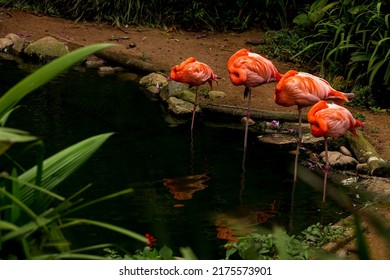
Find the location of a particular element. The image size is (390, 280). picture is located at coordinates (71, 93).